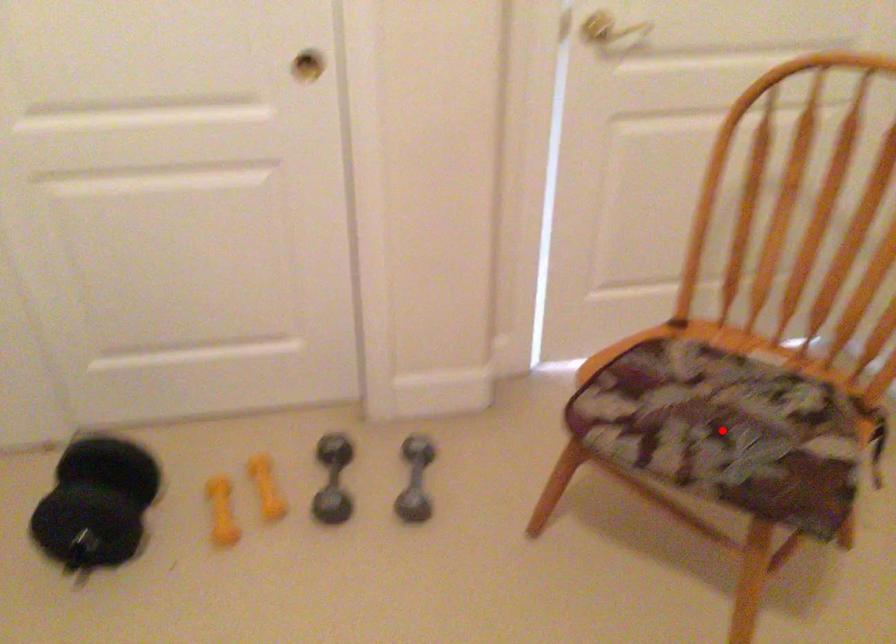
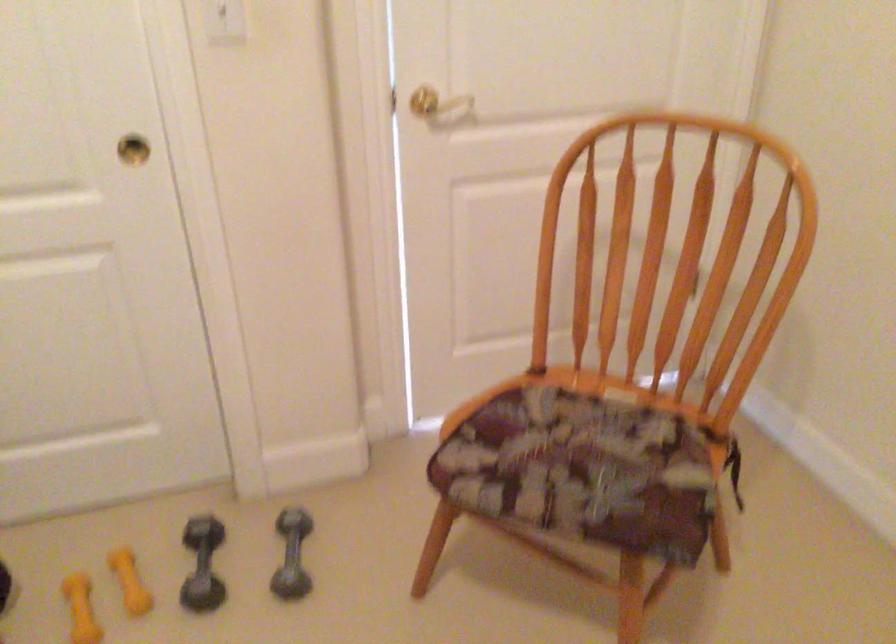
Find the pixel in the second image that matches the highlighted location in the first image.

(582, 469)